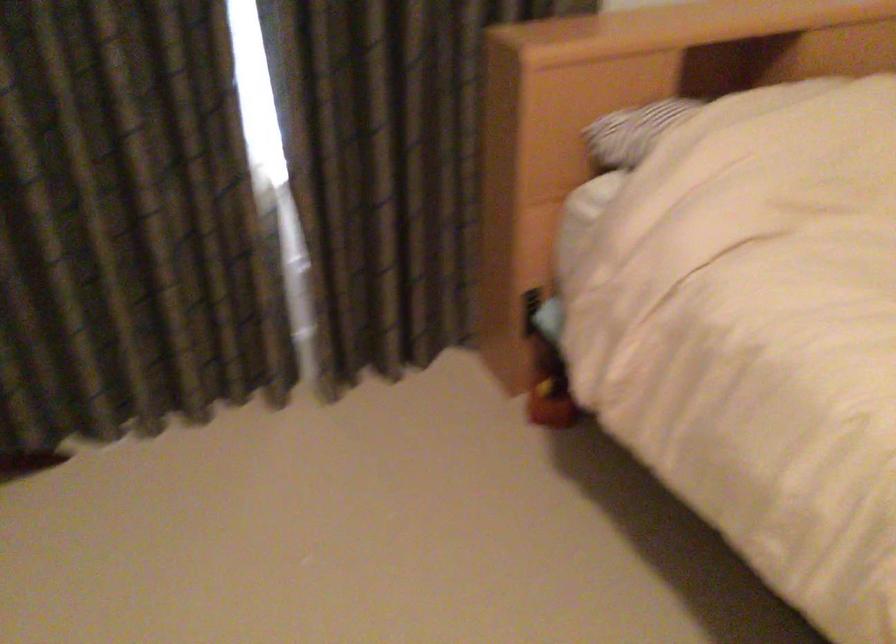
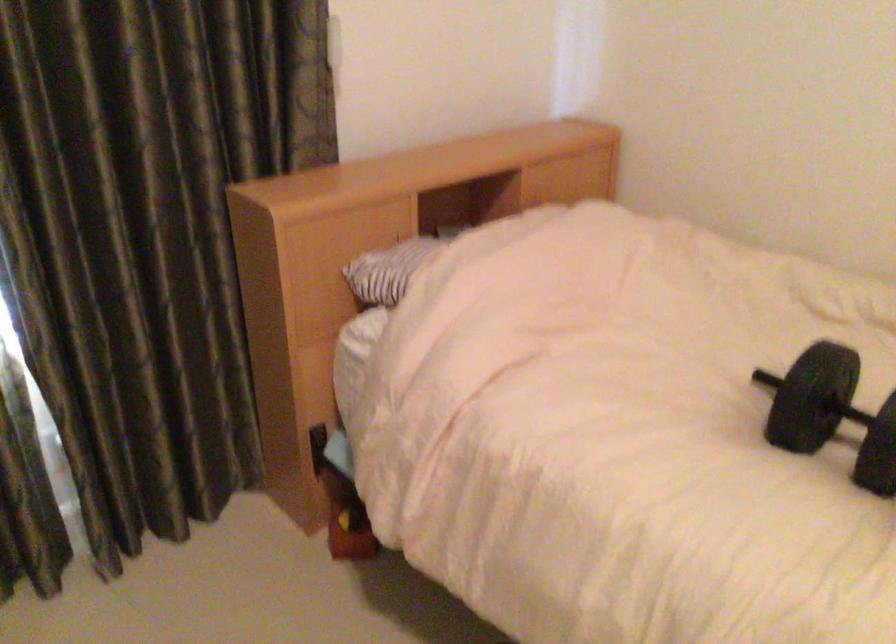
Find the pixel in the second image that matches point 536,307 in the first image.

(317, 447)